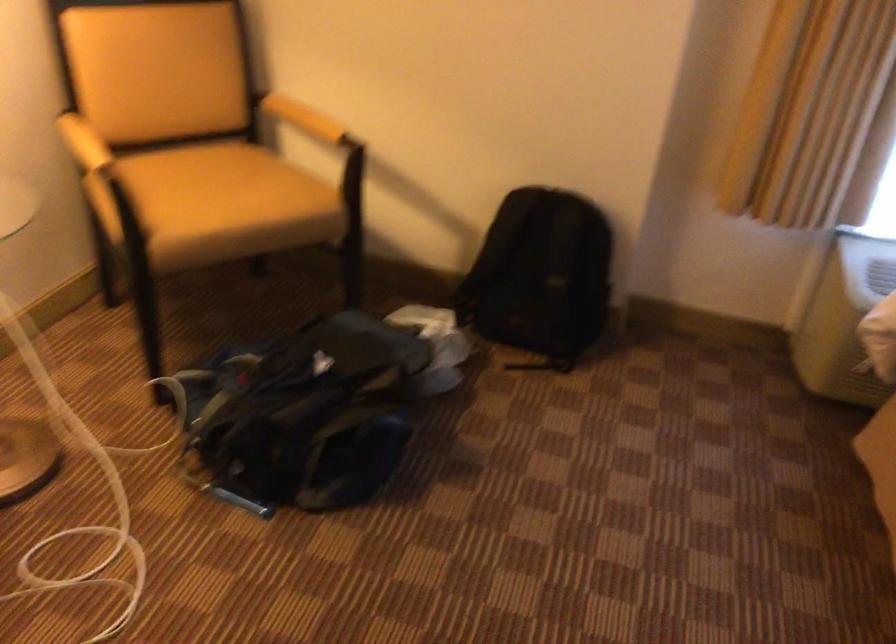
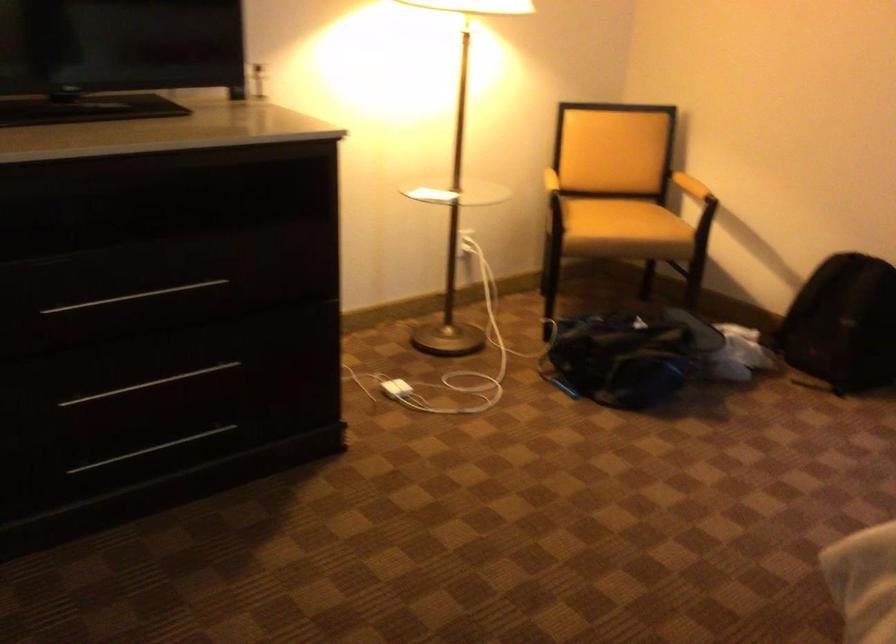
In the second image, find the point that corresponds to (329,129) in the first image.

(690, 185)